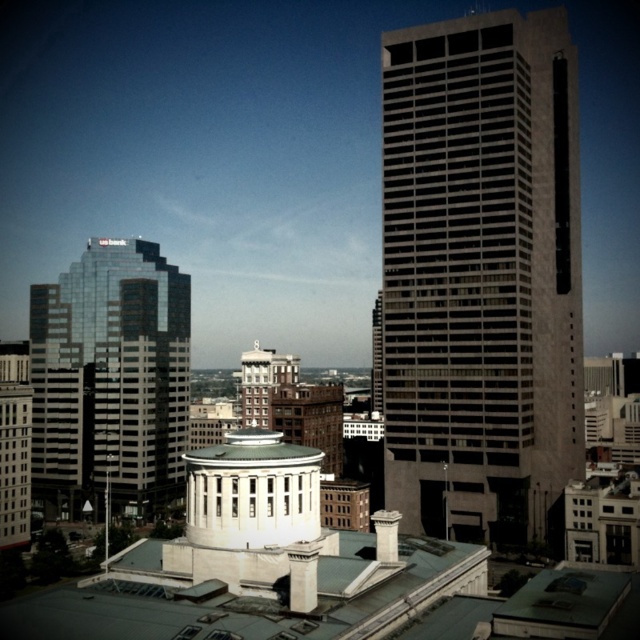
Does gray concrete skyscraper at center have a larger size compared to reflective glass skyscraper at left?

Correct, gray concrete skyscraper at center is larger in size than reflective glass skyscraper at left.

Is gray concrete skyscraper at center shorter than reflective glass skyscraper at left?

No.

Is point (444, 244) closer to camera compared to point (67, 426)?

Yes.

You are a GUI agent. You are given a task and a screenshot of the screen. Output one action in this format:
    pyautogui.click(x=<x>, y=<y>)
    Task: Click on the gray concrete skyscraper at center
    The width and height of the screenshot is (640, 640).
    Given the screenshot: What is the action you would take?
    pyautogui.click(x=481, y=275)